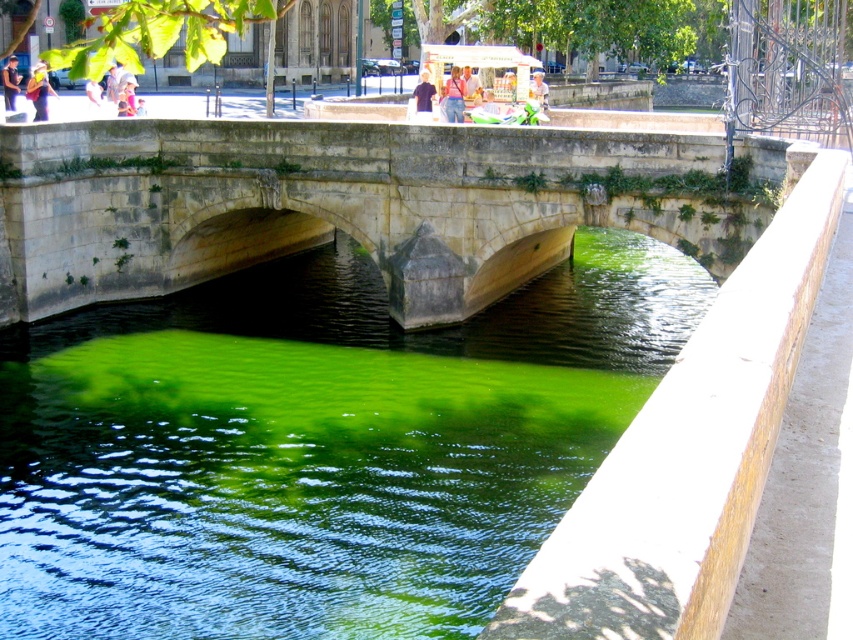
You are a boat captain planning to navigate a narrow boat through the waterway under the stone bridge at center. The boat is 10 meters wide. Can you safely pass under the bridge without hitting the green algae at center?

The green algae at center might be wider than the stone bridge at center. Since the boat is 10 meters wide, it is uncertain whether the waterway under the stone bridge at center is wide enough to accommodate the boat without hitting the green algae at center. Further measurements are needed to confirm the exact width of the bridge and algae.

In the scene shown: You are standing at the point labeled point (273, 196) and want to walk to the point labeled point (103, 630). Which direction should you move in relation to the bridge?

You should move towards the point (103, 630), which is in front of point (273, 196) relative to the bridge.

In the scene shown: You are standing on the stone bridge and looking down at the water. You notice a point marked at coordinates [316,445]. What is located at that point?

The point at coordinates [316,445] corresponds to green algae at center.